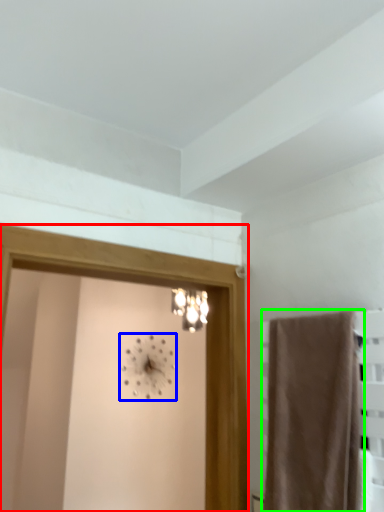
Question: Which object is positioned closest to screen door (highlighted by a red box)? Select from clock (highlighted by a blue box) and curtain (highlighted by a green box).

Choices:
 (A) clock
 (B) curtain

Answer: (B)